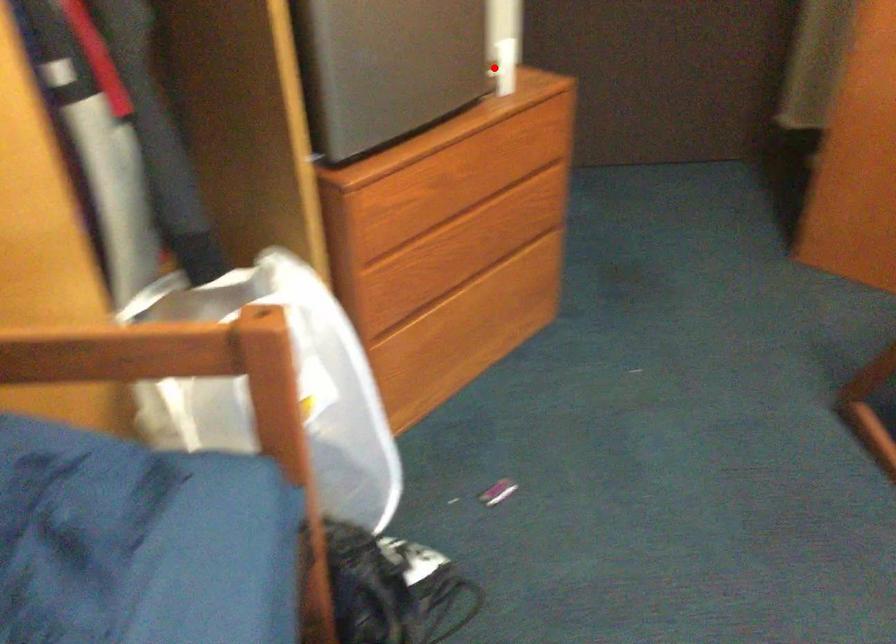
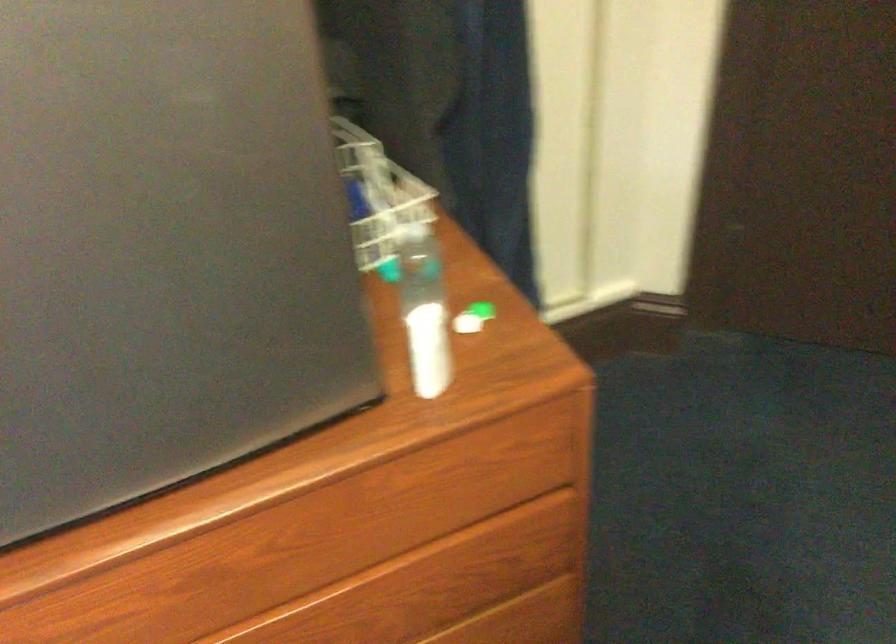
Question: I am providing you with two images of the same scene from different viewpoints. In image1, a red point is highlighted. Considering the same 3D point in image2, which of the following is correct?

Choices:
 (A) It is closer
 (B) It is farther

Answer: (A)